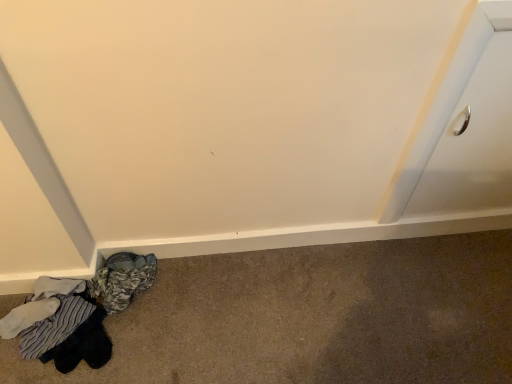
Identify the location of white glossy drawer at upper right. (473, 143).

Describe the element at coordinates (473, 143) in the screenshot. This screenshot has width=512, height=384. I see `white glossy drawer at upper right` at that location.

In order to face white glossy drawer at upper right, should I rotate leftwards or rightwards?

Turn right approximately 30.621 degrees to face it.

The height and width of the screenshot is (384, 512). What do you see at coordinates (77, 312) in the screenshot?
I see `striped cotton socks at lower left` at bounding box center [77, 312].

What are the coordinates of `striped cotton socks at lower left` in the screenshot? It's located at (77, 312).

At what (x,y) coordinates should I click in order to perform the action: click on white glossy drawer at upper right. Please return your answer as a coordinate pair (x, y). Looking at the image, I should click on (473, 143).

Considering the positions of objects striped cotton socks at lower left and white glossy drawer at upper right in the image provided, who is more to the right, striped cotton socks at lower left or white glossy drawer at upper right?

Positioned to the right is white glossy drawer at upper right.

Based on the photo, which object is more forward, striped cotton socks at lower left or white glossy drawer at upper right?

white glossy drawer at upper right.

Which is behind, point (128, 278) or point (461, 191)?

Point (461, 191)

From the picture: From the image's perspective, is striped cotton socks at lower left positioned above or below white glossy drawer at upper right?

striped cotton socks at lower left is below white glossy drawer at upper right.

From a real-world perspective, is striped cotton socks at lower left below white glossy drawer at upper right?

Yes, from a real-world perspective, striped cotton socks at lower left is below white glossy drawer at upper right.

Does striped cotton socks at lower left have a greater width compared to white glossy drawer at upper right?

Indeed, striped cotton socks at lower left has a greater width compared to white glossy drawer at upper right.

In the scene shown: In terms of height, does striped cotton socks at lower left look taller or shorter compared to white glossy drawer at upper right?

Considering their sizes, striped cotton socks at lower left has less height than white glossy drawer at upper right.

Looking at the image, does striped cotton socks at lower left seem bigger or smaller compared to white glossy drawer at upper right?

striped cotton socks at lower left is bigger than white glossy drawer at upper right.

Looking at this image, would you say striped cotton socks at lower left contains white glossy drawer at upper right?

That's incorrect, white glossy drawer at upper right is not inside striped cotton socks at lower left.

Is striped cotton socks at lower left next to white glossy drawer at upper right?

No, striped cotton socks at lower left is not beside white glossy drawer at upper right.

Does striped cotton socks at lower left turn towards white glossy drawer at upper right?

No.

This screenshot has width=512, height=384. In order to click on drawer on the right of striped cotton socks at lower left in this screenshot , I will do `click(473, 143)`.

Would you say white glossy drawer at upper right is to the left or to the right of striped cotton socks at lower left in the picture?

Clearly, white glossy drawer at upper right is on the right of striped cotton socks at lower left in the image.

Is the depth of white glossy drawer at upper right greater than that of striped cotton socks at lower left?

That is False.

Is point (477, 166) closer or farther from the camera than point (117, 279)?

Point (477, 166) appears to be closer to the viewer than point (117, 279).

From the image's perspective, would you say white glossy drawer at upper right is shown under striped cotton socks at lower left?

Incorrect, from the image's perspective, white glossy drawer at upper right is higher than striped cotton socks at lower left.

From a real-world perspective, is white glossy drawer at upper right above or below striped cotton socks at lower left?

In terms of real-world spatial position, white glossy drawer at upper right is above striped cotton socks at lower left.

Can you confirm if white glossy drawer at upper right is wider than striped cotton socks at lower left?

In fact, white glossy drawer at upper right might be narrower than striped cotton socks at lower left.

Considering the sizes of objects white glossy drawer at upper right and striped cotton socks at lower left in the image provided, who is shorter, white glossy drawer at upper right or striped cotton socks at lower left?

Standing shorter between the two is striped cotton socks at lower left.

Can you confirm if white glossy drawer at upper right is bigger than striped cotton socks at lower left?

Actually, white glossy drawer at upper right might be smaller than striped cotton socks at lower left.

Is white glossy drawer at upper right inside the boundaries of striped cotton socks at lower left, or outside?

white glossy drawer at upper right is not inside striped cotton socks at lower left, it's outside.

Are white glossy drawer at upper right and striped cotton socks at lower left beside each other?

No, white glossy drawer at upper right is not in contact with striped cotton socks at lower left.

Is white glossy drawer at upper right facing away from striped cotton socks at lower left?

No.

Can you tell me how much white glossy drawer at upper right and striped cotton socks at lower left differ in facing direction?

white glossy drawer at upper right and striped cotton socks at lower left are facing 0.327 degrees away from each other.

Where is `laundry that appears behind the white glossy drawer at upper right`? This screenshot has height=384, width=512. laundry that appears behind the white glossy drawer at upper right is located at coordinates (77, 312).

The height and width of the screenshot is (384, 512). What are the coordinates of `laundry below the white glossy drawer at upper right (from a real-world perspective)` in the screenshot? It's located at (77, 312).

Locate an element on the screen. laundry that is below the white glossy drawer at upper right (from the image's perspective) is located at coordinates (77, 312).